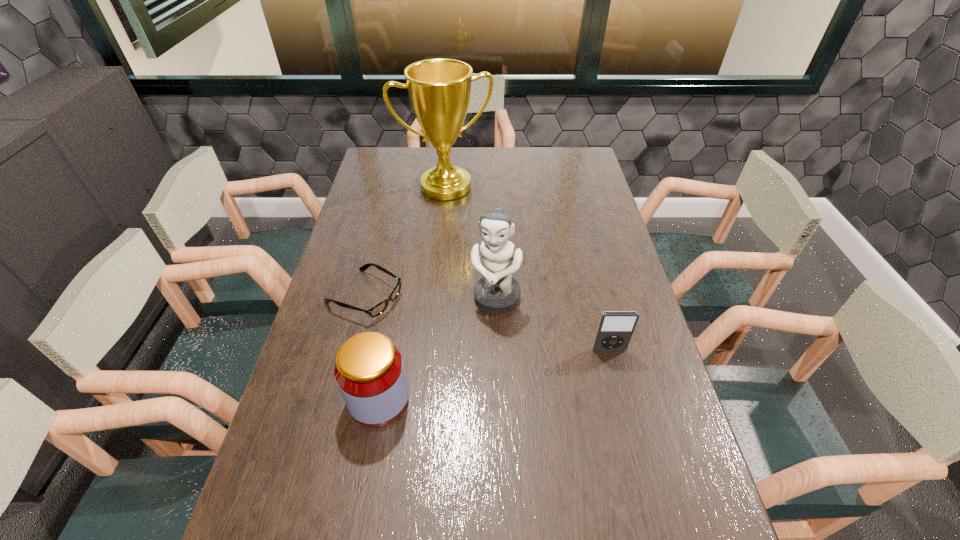
This screenshot has width=960, height=540. In order to click on vacant space on the desktop that is between the nearest object and the rightmost object and is positioned by the handles of the award in this screenshot , I will do `click(516, 370)`.

Where is `free space on the desktop that is between the nearest object and the iPod and is positioned on the front-facing side of the fourth shortest object`? The width and height of the screenshot is (960, 540). free space on the desktop that is between the nearest object and the iPod and is positioned on the front-facing side of the fourth shortest object is located at coordinates (472, 379).

Locate an element on the screen. The image size is (960, 540). free space on the desktop that is between the jar and the iPod and is positioned on the front-facing side of the spectacles is located at coordinates (516, 370).